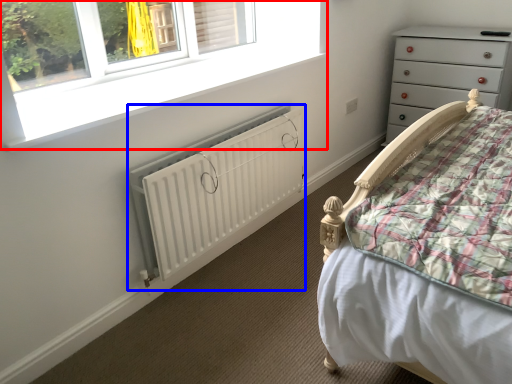
Question: Which point is further to the camera, window (highlighted by a red box) or radiator (highlighted by a blue box)?

Choices:
 (A) window
 (B) radiator

Answer: (B)